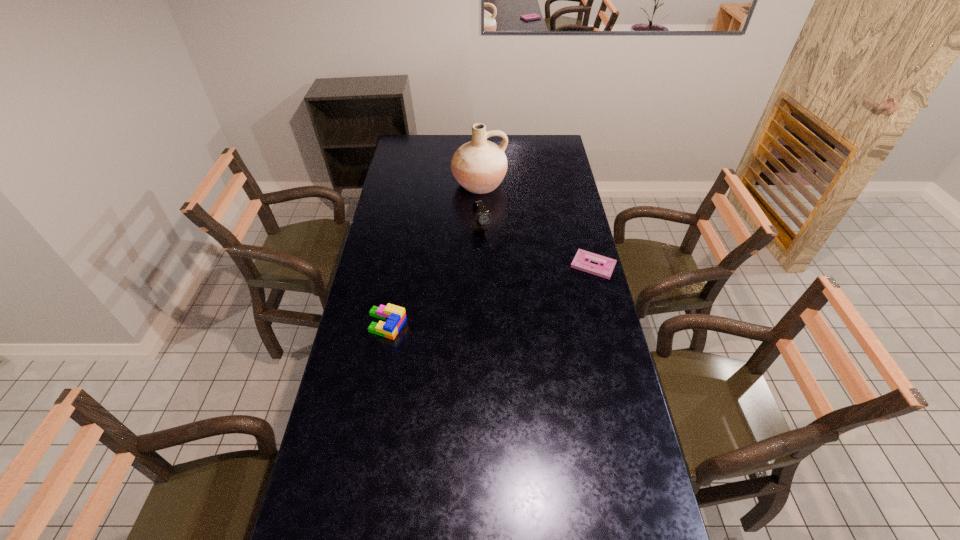
Locate an element on the screen. This screenshot has width=960, height=540. vacant area situated 0.060m to pour from the handle of the tallest object is located at coordinates (489, 207).

Find the location of a particular element. vacant position located 0.070m to pour from the handle of the tallest object is located at coordinates (489, 208).

You are a GUI agent. You are given a task and a screenshot of the screen. Output one action in this format:
    pyautogui.click(x=<x>, y=<y>)
    Task: Click on the vacant position located to pour from the handle of the tallest object
    
    Given the screenshot: What is the action you would take?
    pyautogui.click(x=503, y=245)

At what (x,y) coordinates should I click in order to perform the action: click on free space located on the face of the second farthest object. Please return your answer as a coordinate pair (x, y). This screenshot has width=960, height=540. Looking at the image, I should click on (525, 293).

At what (x,y) coordinates should I click in order to perform the action: click on blank space located 0.170m on the face of the second farthest object. Please return your answer as a coordinate pair (x, y). This screenshot has height=540, width=960. Looking at the image, I should click on 503,261.

What are the coordinates of `blank space located 0.070m on the face of the second farthest object` in the screenshot? It's located at (492, 246).

Locate an element on the screen. object at the left edge is located at coordinates (395, 316).

Where is `object present at the right edge`? object present at the right edge is located at coordinates (581, 261).

In order to click on vacant position at the far edge of the desktop in this screenshot , I will do `click(498, 139)`.

In the image, there is a desktop. Identify the location of vacant space at the left edge. Image resolution: width=960 pixels, height=540 pixels. pos(362,429).